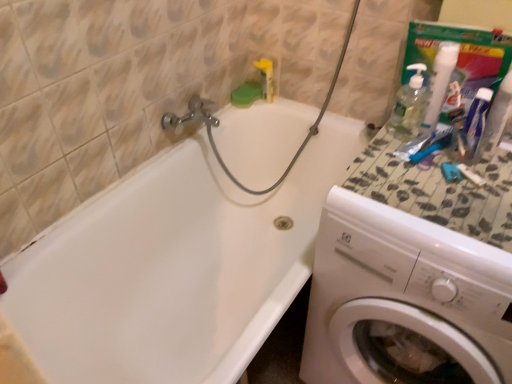
This screenshot has height=384, width=512. I want to click on free space above speckled stone countertop at right (from a real-world perspective), so click(x=438, y=172).